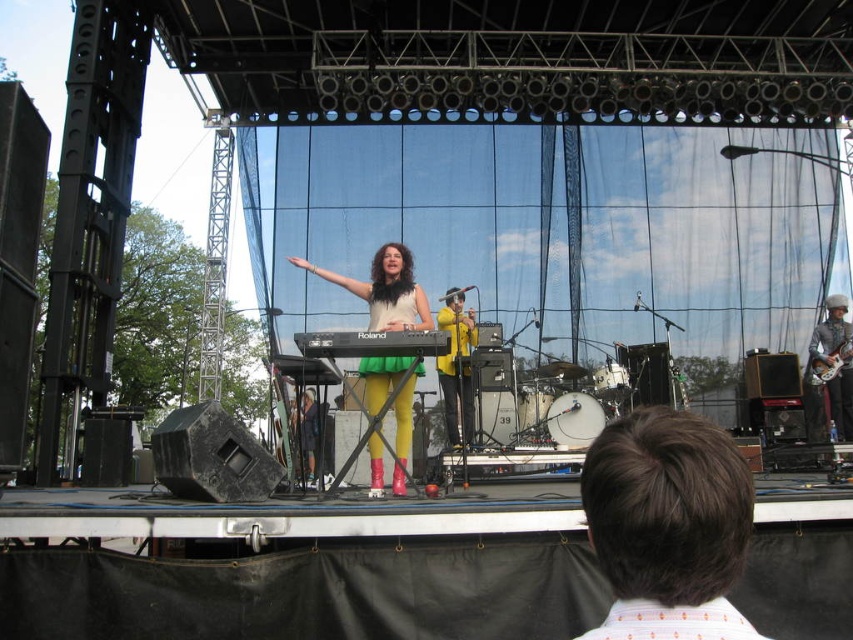
Question: Which point is farther from the camera taking this photo?

Choices:
 (A) click(x=843, y=333)
 (B) click(x=463, y=388)
 (C) click(x=311, y=403)

Answer: (A)

Question: Estimate the real-world distances between objects in this image. Which object is closer to the glossy wood electric guitar at center right?

Choices:
 (A) matte green dress at center
 (B) black plastic keyboard at center

Answer: (A)

Question: Does brown hair at center have a larger size compared to matte green dress at center?

Choices:
 (A) yes
 (B) no

Answer: (A)

Question: Is the position of black plastic keyboard at center more distant than that of yellow fabric dress at center?

Choices:
 (A) no
 (B) yes

Answer: (A)

Question: Which object is farther from the camera taking this photo?

Choices:
 (A) yellow fabric dress at center
 (B) yellow matte jacket at center
 (C) glossy wood electric guitar at center right

Answer: (C)

Question: Can you confirm if matte green dress at center is positioned below shiny silver guitar at right?

Choices:
 (A) no
 (B) yes

Answer: (A)